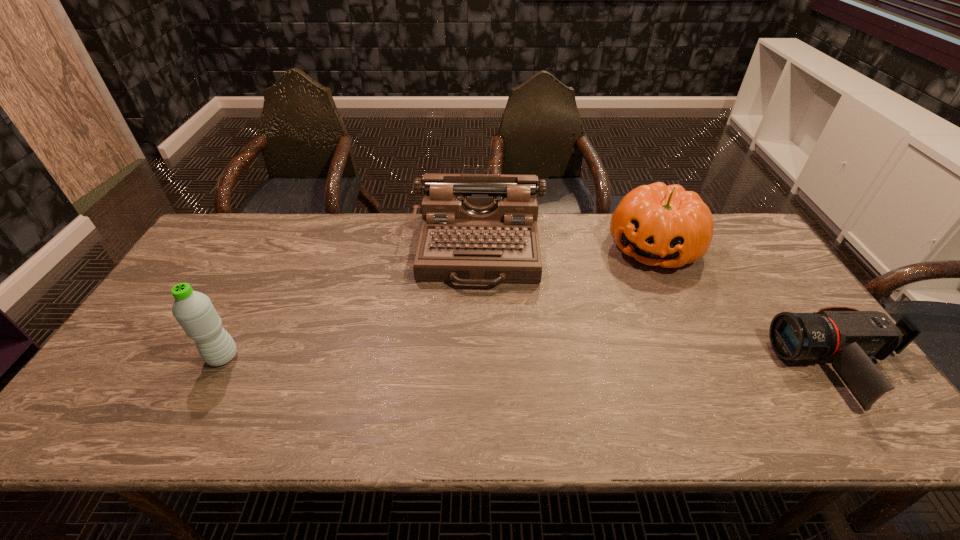
Identify the location of free spot between the leftmost object and the rightmost object. (534, 362).

Identify the location of vacant point located between the leftmost object and the second object from left to right. (351, 302).

The image size is (960, 540). Find the location of `vacant point located between the pumpkin and the third object from right to left`. vacant point located between the pumpkin and the third object from right to left is located at coordinates (566, 248).

The image size is (960, 540). Find the location of `empty location between the pumpkin and the typewriter`. empty location between the pumpkin and the typewriter is located at coordinates (566, 248).

Locate an element on the screen. This screenshot has height=540, width=960. vacant area that lies between the water bottle and the typewriter is located at coordinates (351, 302).

Locate an element on the screen. free area in between the typewriter and the shortest object is located at coordinates (661, 308).

Identify the location of free space between the third object from left to right and the water bottle. This screenshot has width=960, height=540. (439, 302).

This screenshot has width=960, height=540. What are the coordinates of `object that is the third closest to the water bottle` in the screenshot? It's located at click(x=851, y=339).

Locate an element on the screen. Image resolution: width=960 pixels, height=540 pixels. object that is the second closest to the third object from right to left is located at coordinates [x=194, y=311].

Locate an element on the screen. The width and height of the screenshot is (960, 540). free space that satisfies the following two spatial constraints: 1. on the front side of the camcorder; 2. on the lens of the third object from left to right is located at coordinates (708, 367).